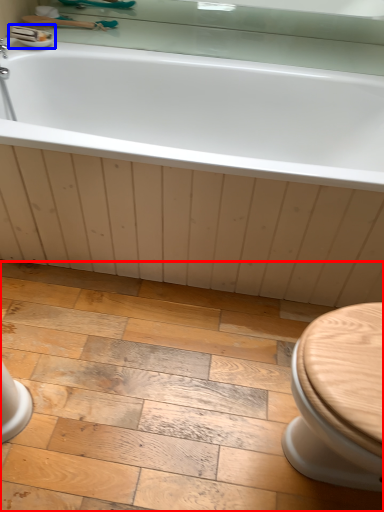
Question: Among these objects, which one is nearest to the camera, ceramic tile (highlighted by a red box) or sink (highlighted by a blue box)?

Choices:
 (A) ceramic tile
 (B) sink

Answer: (A)